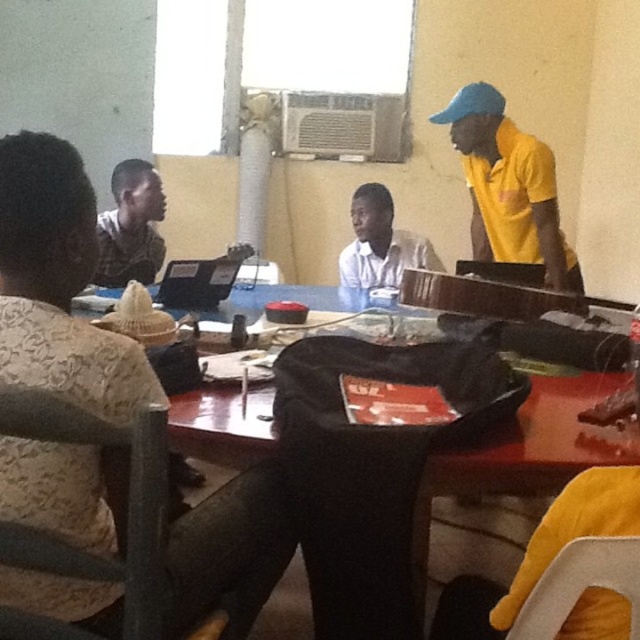
Question: In this image, where is yellow matte shirt at upper right located relative to black fabric bag at center?

Choices:
 (A) below
 (B) above

Answer: (B)

Question: Is yellow matte shirt at upper right in front of white matte shirt at center?

Choices:
 (A) no
 (B) yes

Answer: (B)

Question: Does yellow matte shirt at upper right appear on the left side of white matte shirt at center?

Choices:
 (A) no
 (B) yes

Answer: (A)

Question: Which point is farther from the camera taking this photo?

Choices:
 (A) (406, 243)
 (B) (104, 241)
 (C) (481, 456)

Answer: (A)

Question: Which point appears closest to the camera in this image?

Choices:
 (A) (244, 451)
 (B) (125, 244)

Answer: (A)

Question: Estimate the real-world distances between objects in this image. Which object is farther from the yellow matte shirt at upper right?

Choices:
 (A) black fabric bag at center
 (B) white matte shirt at center
 (C) patterned fabric shirt at left

Answer: (C)